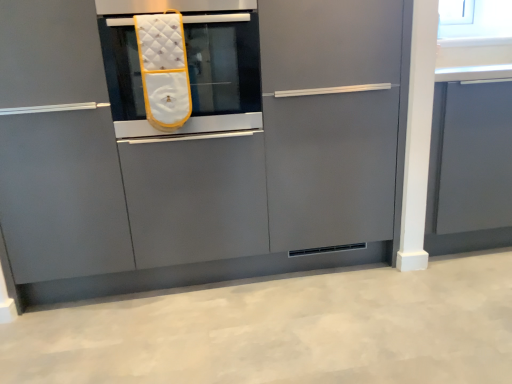
Question: Is white quilted oven mitt at center surrounding matte gray cabinet at center, which is the second cabinetry in right-to-left order?

Choices:
 (A) yes
 (B) no

Answer: (B)

Question: Is white quilted oven mitt at center thinner than matte gray cabinet at center, which is the second cabinetry in right-to-left order?

Choices:
 (A) yes
 (B) no

Answer: (B)

Question: From the image's perspective, is white quilted oven mitt at center located beneath matte gray cabinet at center, the first cabinetry from the left?

Choices:
 (A) yes
 (B) no

Answer: (B)

Question: Can you confirm if white quilted oven mitt at center is bigger than matte gray cabinet at center, which is the second cabinetry in right-to-left order?

Choices:
 (A) yes
 (B) no

Answer: (B)

Question: From a real-world perspective, is white quilted oven mitt at center beneath matte gray cabinet at center, which is the second cabinetry in right-to-left order?

Choices:
 (A) yes
 (B) no

Answer: (B)

Question: Is white quilted oven mitt at center taller or shorter than matte gray cabinet at center, which is the second cabinetry in right-to-left order?

Choices:
 (A) short
 (B) tall

Answer: (A)

Question: Choose the correct answer: Is white quilted oven mitt at center inside matte gray cabinet at center, the first cabinetry from the left, or outside it?

Choices:
 (A) inside
 (B) outside

Answer: (A)

Question: Considering the relative positions of white quilted oven mitt at center and matte gray cabinet at center, the first cabinetry from the left, in the image provided, is white quilted oven mitt at center to the left or to the right of matte gray cabinet at center, the first cabinetry from the left,?

Choices:
 (A) right
 (B) left

Answer: (B)

Question: Looking at their shapes, would you say white quilted oven mitt at center is wider or thinner than matte gray cabinet at center, which is the second cabinetry in right-to-left order?

Choices:
 (A) wide
 (B) thin

Answer: (A)

Question: From a real-world perspective, is white quilted oven mitt at center positioned above or below matte gray cabinet at right, marked as the first cabinetry in a right-to-left arrangement?

Choices:
 (A) below
 (B) above

Answer: (B)

Question: From the image's perspective, is white quilted oven mitt at center located above or below matte gray cabinet at right, the 2th cabinetry positioned from the left?

Choices:
 (A) above
 (B) below

Answer: (A)

Question: From their relative heights in the image, would you say white quilted oven mitt at center is taller or shorter than matte gray cabinet at right, marked as the first cabinetry in a right-to-left arrangement?

Choices:
 (A) short
 (B) tall

Answer: (A)

Question: Is white quilted oven mitt at center bigger or smaller than matte gray cabinet at right, the 2th cabinetry positioned from the left?

Choices:
 (A) small
 (B) big

Answer: (A)

Question: In terms of width, does matte gray cabinet at right, marked as the first cabinetry in a right-to-left arrangement, look wider or thinner when compared to matte gray cabinet at center, the first cabinetry from the left?

Choices:
 (A) wide
 (B) thin

Answer: (B)

Question: Is point (448, 130) closer or farther from the camera than point (91, 114)?

Choices:
 (A) farther
 (B) closer

Answer: (A)